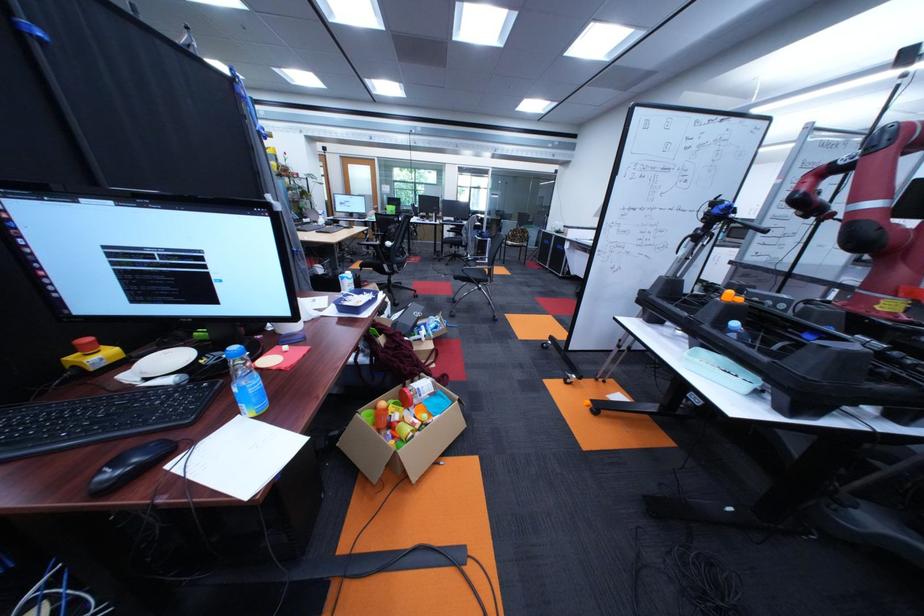
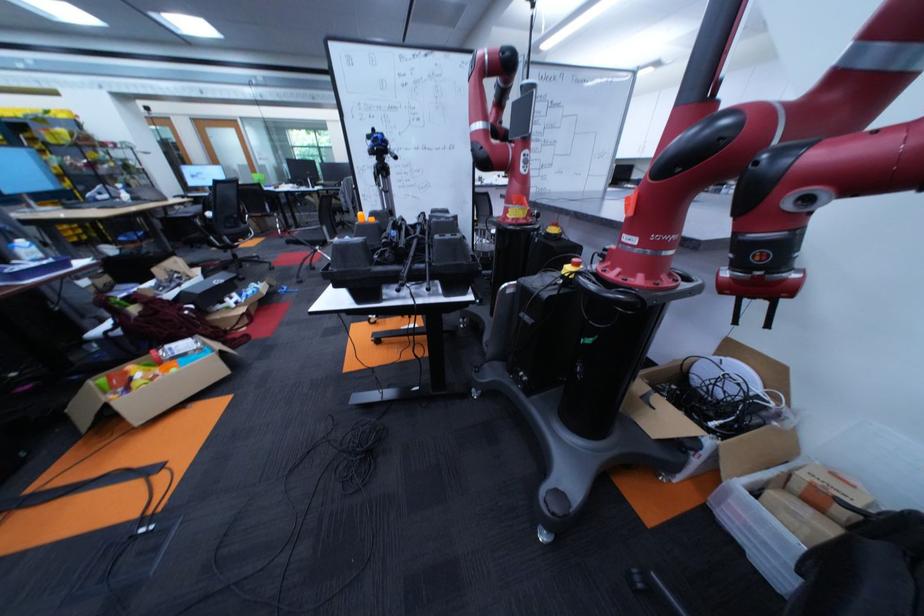
In the second image, find the point that corresponds to (360,280) in the first image.

(40, 249)